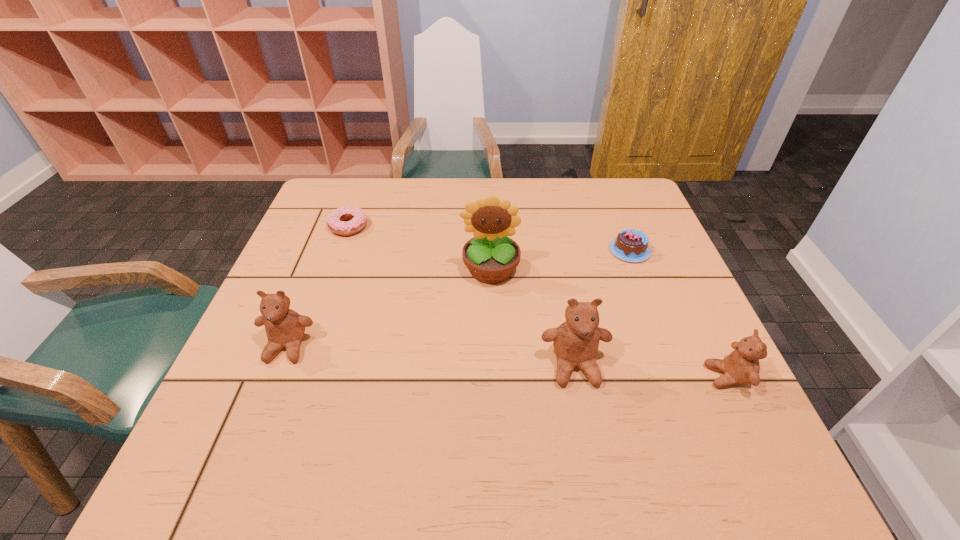
Please point a spot to place another teddy_bear for symmetrical spacing. Please provide its 2D coordinates. Your answer should be formatted as a tuple, i.e. [(x, y)], where the tuple contains the x and y coordinates of a point satisfying the conditions above.

[(428, 356)]